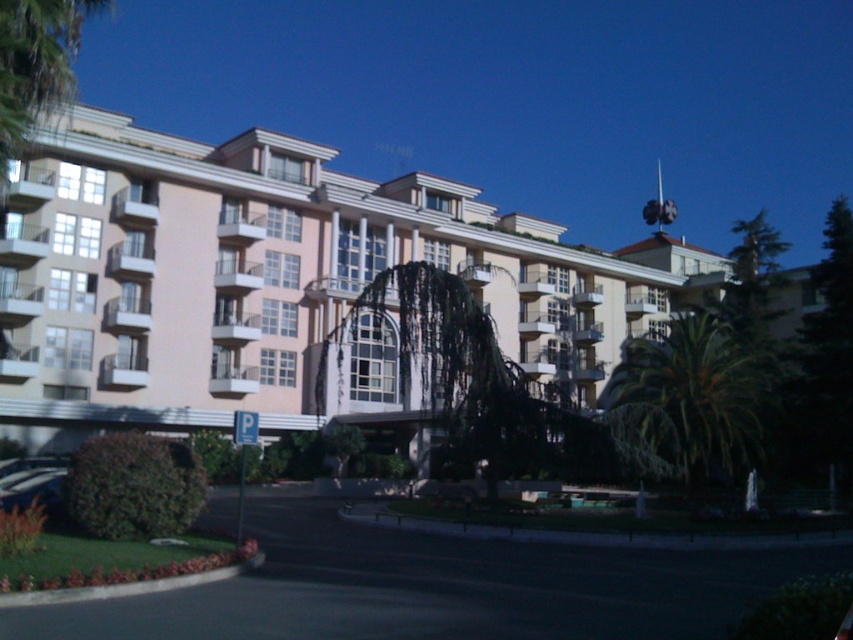
Which of these two, beige/smooth building at center or green leafy palm tree at upper left, stands shorter?

With less height is green leafy palm tree at upper left.

Which is behind, point (705, 280) or point (15, 102)?

The point (705, 280) is more distant.

The height and width of the screenshot is (640, 853). I want to click on beige/smooth building at center, so click(x=273, y=275).

Is beige/smooth building at center further to the viewer compared to green leafy palm at right?

That is True.

Which is in front, point (186, 408) or point (682, 336)?

Point (682, 336) is in front.

Who is more forward, (143,314) or (625,385)?

Positioned in front is point (625,385).

This screenshot has height=640, width=853. I want to click on beige/smooth building at center, so click(273, 275).

Between green leafy palm at right and green leafy palm tree at upper left, which one has less height?

green leafy palm tree at upper left is shorter.

Does green leafy palm at right appear on the left side of green leafy palm tree at upper left?

No, green leafy palm at right is not to the left of green leafy palm tree at upper left.

This screenshot has height=640, width=853. Describe the element at coordinates (688, 401) in the screenshot. I see `green leafy palm at right` at that location.

Image resolution: width=853 pixels, height=640 pixels. Find the location of `green leafy palm at right`. green leafy palm at right is located at coordinates (688, 401).